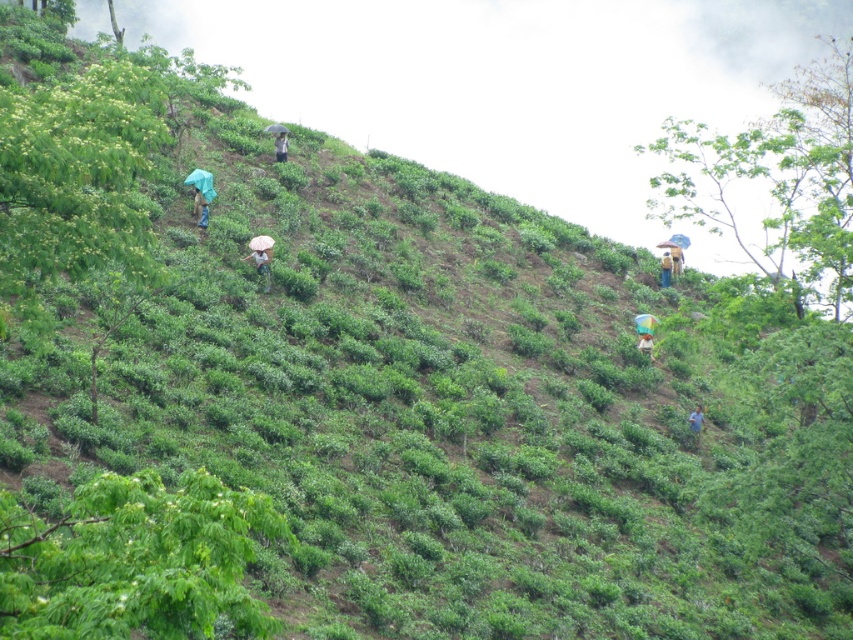
You are standing at the top of the hill and see the white fabric umbrella at center and the light brown fabric at center below you. Which object is closer to your left side?

The white fabric umbrella at center is closer to your left side because it is positioned to the left of the light brown fabric at center.

You are standing at the bottom of the hill on the left side. You want to walk directly towards the white fabric umbrella at center. Which direction should you head?

You should head to the right and slightly upwards since the white fabric umbrella at center is located at coordinates that are to the right and higher up from your starting position on the left side of the hill.

Consider the image. You are a visitor standing at the bottom of the hillside looking up. You see the white fabric umbrella at center and the light brown fabric at center. Which object is taller from your viewpoint?

The white fabric umbrella at center is taller than the light brown fabric at center.